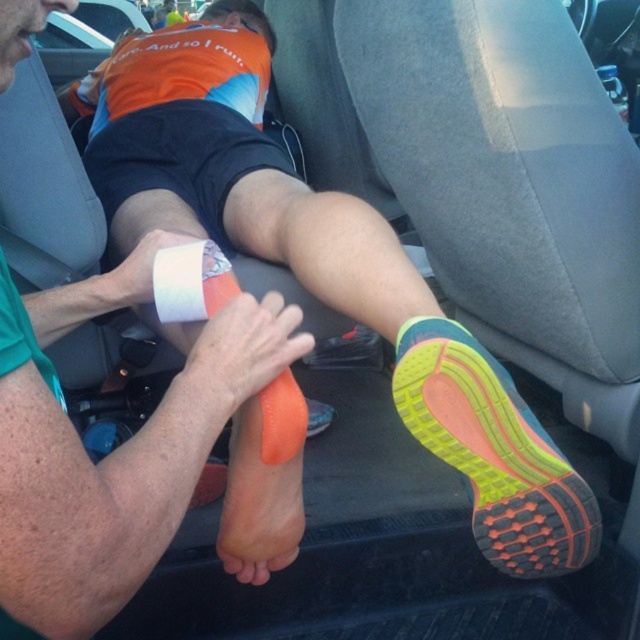
Question: Which of the following is the farthest from the observer?

Choices:
 (A) (300, 532)
 (B) (509, 483)
 (C) (212, 381)

Answer: (A)

Question: Can you confirm if matte orange sock at center is wider than orange foam at center?

Choices:
 (A) yes
 (B) no

Answer: (A)

Question: Considering the real-world distances, which object is closest to the white adhesive tape at lower center?

Choices:
 (A) orange foam at center
 (B) matte orange sock at center
 (C) white adhesive tape at center

Answer: (C)

Question: Can you confirm if matte orange sock at center is positioned below white adhesive tape at center?

Choices:
 (A) no
 (B) yes

Answer: (B)

Question: Does white adhesive tape at lower center lie in front of white adhesive tape at center?

Choices:
 (A) no
 (B) yes

Answer: (B)

Question: Which point appears farthest from the camera in this image?

Choices:
 (A) click(202, 275)
 (B) click(22, 381)
 (C) click(198, 296)

Answer: (A)